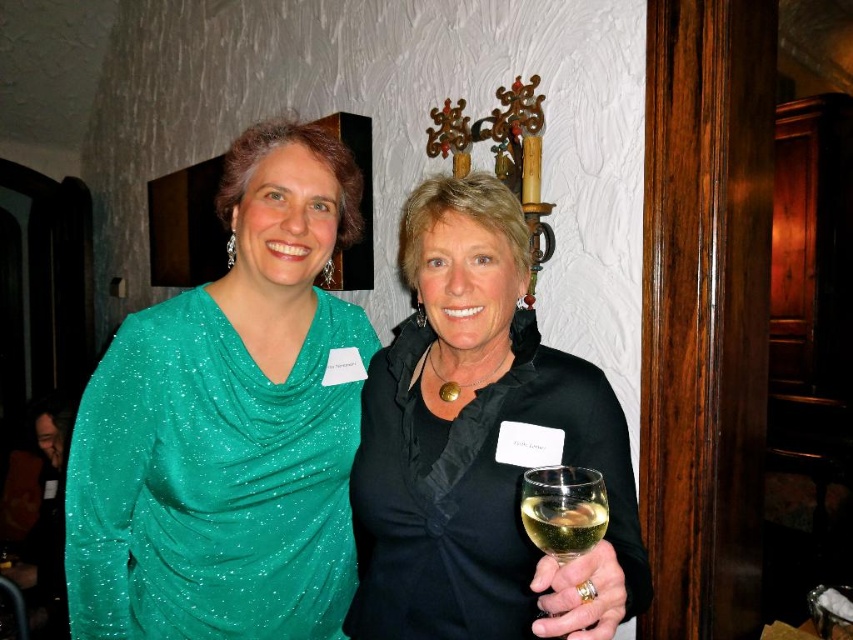
Question: Can you confirm if green sparkly dress at center is positioned below translucent glass at center?

Choices:
 (A) yes
 (B) no

Answer: (B)

Question: Which of the following is the farthest from the observer?

Choices:
 (A) clear glass wine glass at center
 (B) translucent glass at center
 (C) green sparkly dress at center
 (D) black satin blouse at center

Answer: (C)

Question: Is green sparkly dress at center positioned before clear glass wine glass at center?

Choices:
 (A) no
 (B) yes

Answer: (A)

Question: Is black satin blouse at center bigger than translucent glass at center?

Choices:
 (A) yes
 (B) no

Answer: (A)

Question: Which object is positioned closest to the black satin blouse at center?

Choices:
 (A) translucent glass at center
 (B) green sparkly dress at center

Answer: (B)

Question: Which of the following is the closest to the observer?

Choices:
 (A) clear glass wine glass at center
 (B) translucent glass at center

Answer: (A)